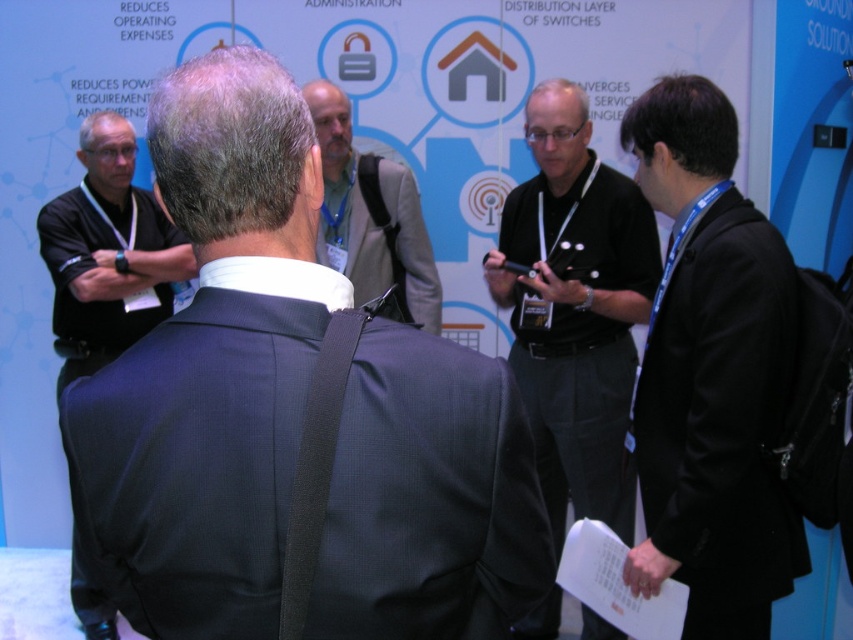
Question: Among these points, which one is farthest from the camera?

Choices:
 (A) (154, 244)
 (B) (666, 528)

Answer: (A)

Question: Is dark gray suit at center above gray suit at center?

Choices:
 (A) no
 (B) yes

Answer: (A)

Question: Estimate the real-world distances between objects in this image. Which object is closer to the gray suit at center?

Choices:
 (A) black fabric shirt at left
 (B) black shirt at center

Answer: (B)

Question: Can you confirm if black fabric shirt at left is wider than gray suit at center?

Choices:
 (A) yes
 (B) no

Answer: (A)

Question: Is the position of dark gray suit at center less distant than that of black fabric suit at right?

Choices:
 (A) no
 (B) yes

Answer: (B)

Question: Which point is farther to the camera?

Choices:
 (A) (366, 209)
 (B) (505, 301)
 (C) (271, 192)

Answer: (B)